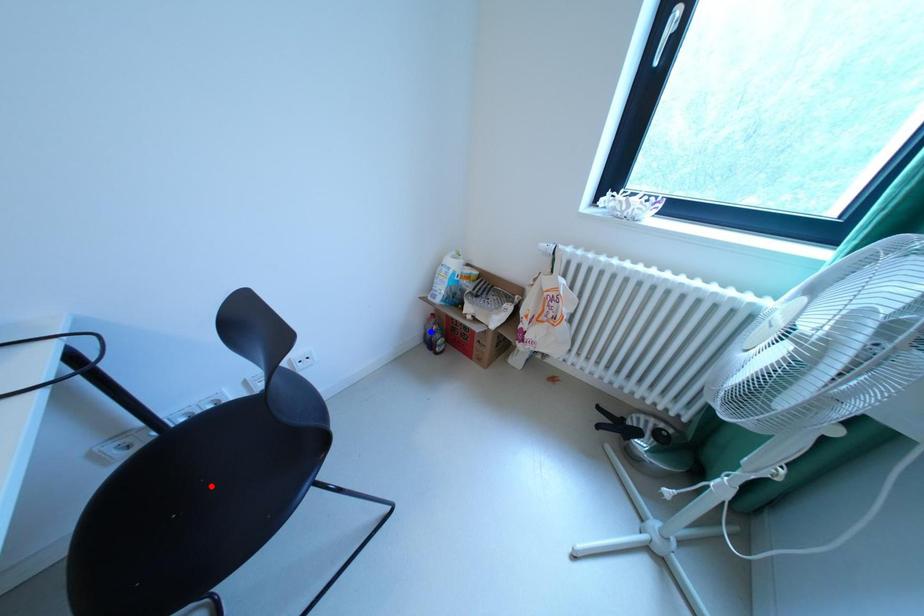
Question: Which of the two points in the image is closer to the camera?

Choices:
 (A) Blue point is closer.
 (B) Red point is closer.

Answer: (B)